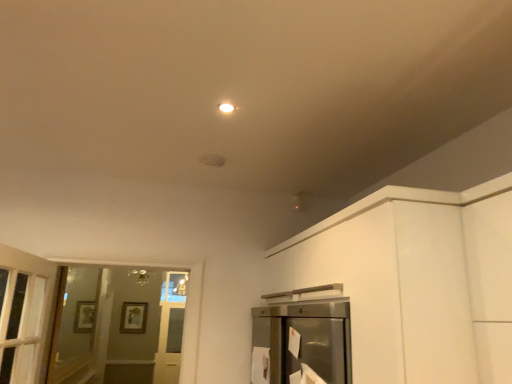
Find the location of a particular element. Image resolution: width=512 pixels, height=384 pixels. clear glass screen door at left is located at coordinates (74, 326).

Image resolution: width=512 pixels, height=384 pixels. What do you see at coordinates (74, 326) in the screenshot? I see `clear glass screen door at left` at bounding box center [74, 326].

What do you see at coordinates (227, 108) in the screenshot?
I see `white glossy light fixture at upper center` at bounding box center [227, 108].

Looking at this image, measure the distance between white glossy light fixture at upper center and camera.

white glossy light fixture at upper center and camera are 5.56 feet apart.

Identify the location of white glossy light fixture at upper center. (227, 108).

Measure the distance between point (226, 112) and camera.

Point (226, 112) is 5.78 feet away from camera.

What are the coordinates of `clear glass screen door at left` in the screenshot? It's located at [74, 326].

Visually, is clear glass screen door at left positioned to the left or to the right of white glossy light fixture at upper center?

clear glass screen door at left is positioned on white glossy light fixture at upper center's left side.

Which object is closer to the camera, clear glass screen door at left or white glossy light fixture at upper center?

white glossy light fixture at upper center is more forward.

Which is farther, (86, 337) or (228, 109)?

Positioned behind is point (86, 337).

From the image's perspective, is clear glass screen door at left located above white glossy light fixture at upper center?

No.

From a real-world perspective, is clear glass screen door at left located beneath white glossy light fixture at upper center?

Indeed, from a real-world perspective, clear glass screen door at left is positioned beneath white glossy light fixture at upper center.

Can you confirm if clear glass screen door at left is wider than white glossy light fixture at upper center?

No, clear glass screen door at left is not wider than white glossy light fixture at upper center.

Considering the sizes of objects clear glass screen door at left and white glossy light fixture at upper center in the image provided, who is taller, clear glass screen door at left or white glossy light fixture at upper center?

Standing taller between the two is clear glass screen door at left.

Considering the sizes of objects clear glass screen door at left and white glossy light fixture at upper center in the image provided, who is bigger, clear glass screen door at left or white glossy light fixture at upper center?

Bigger between the two is clear glass screen door at left.

Is clear glass screen door at left not within white glossy light fixture at upper center?

That's correct, clear glass screen door at left is outside of white glossy light fixture at upper center.

Would you consider clear glass screen door at left to be distant from white glossy light fixture at upper center?

Result: Absolutely, clear glass screen door at left is distant from white glossy light fixture at upper center.

Is clear glass screen door at left facing towards white glossy light fixture at upper center?

No, clear glass screen door at left is not aimed at white glossy light fixture at upper center.

Can you tell me how much clear glass screen door at left and white glossy light fixture at upper center differ in facing direction?

180 degrees separate the facing orientations of clear glass screen door at left and white glossy light fixture at upper center.

This screenshot has height=384, width=512. In order to click on screen door on the left of white glossy light fixture at upper center in this screenshot , I will do `click(74, 326)`.

Which is more to the right, white glossy light fixture at upper center or clear glass screen door at left?

white glossy light fixture at upper center.

Is the depth of white glossy light fixture at upper center greater than that of clear glass screen door at left?

No, white glossy light fixture at upper center is closer to the viewer.

Between point (225, 102) and point (78, 349), which one is positioned behind?

The point (78, 349) is behind.

From the image's perspective, between white glossy light fixture at upper center and clear glass screen door at left, which one is located above?

white glossy light fixture at upper center.

Consider the image. From a real-world perspective, does white glossy light fixture at upper center sit lower than clear glass screen door at left?

Incorrect, from a real-world perspective, white glossy light fixture at upper center is higher than clear glass screen door at left.

Between white glossy light fixture at upper center and clear glass screen door at left, which one has smaller width?

clear glass screen door at left.

Can you confirm if white glossy light fixture at upper center is shorter than clear glass screen door at left?

Correct, white glossy light fixture at upper center is not as tall as clear glass screen door at left.

Based on their sizes in the image, would you say white glossy light fixture at upper center is bigger or smaller than clear glass screen door at left?

white glossy light fixture at upper center is smaller than clear glass screen door at left.

Would you say white glossy light fixture at upper center is outside clear glass screen door at left?

Indeed, white glossy light fixture at upper center is completely outside clear glass screen door at left.

Are white glossy light fixture at upper center and clear glass screen door at left beside each other?

They are not placed beside each other.

Is white glossy light fixture at upper center positioned with its back to clear glass screen door at left?

No.

How many degrees apart are the facing directions of white glossy light fixture at upper center and clear glass screen door at left?

There is a 180-degree angle between the facing directions of white glossy light fixture at upper center and clear glass screen door at left.

Looking at this image, how distant is white glossy light fixture at upper center from clear glass screen door at left?

5.40 meters.

Where is `lighting located in front of the clear glass screen door at left`? This screenshot has height=384, width=512. lighting located in front of the clear glass screen door at left is located at coordinates (227, 108).

Image resolution: width=512 pixels, height=384 pixels. What are the coordinates of `lighting above the clear glass screen door at left (from the image's perspective)` in the screenshot? It's located at (227, 108).

I want to click on screen door that appears below the white glossy light fixture at upper center (from the image's perspective), so click(74, 326).